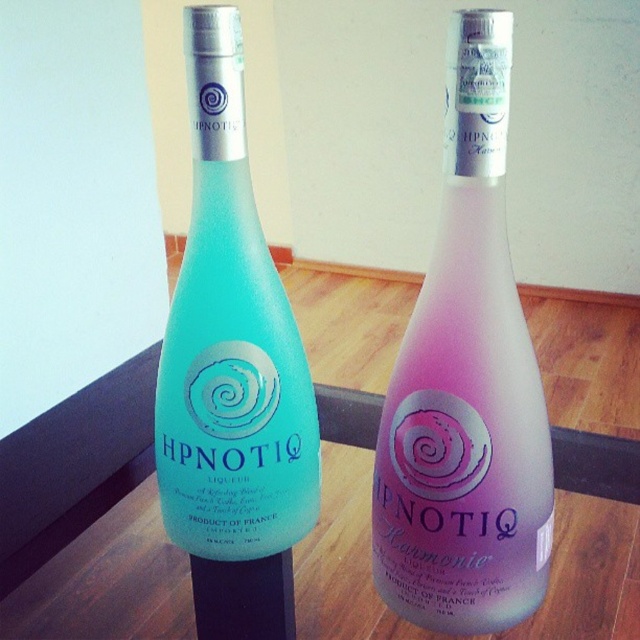
You are at a bar and see two HPNOTIQ liqueur bottles on the counter. The pink glass bottle at center and the matte glass bottle at left. Which one is positioned more to the left?

The matte glass bottle at left is positioned more to the left than the pink glass bottle at center.

You are a bartender preparing a drink and need to know which bottle is shorter. You have two HPNOTIQ liqueur bottles in front of you, a pink glass bottle at center and a matte glass bottle at left. Which one is shorter?

The pink glass bottle at center has a lesser height compared to the matte glass bottle at left, so the pink glass bottle at center is shorter.

You are looking at two points on the HPNOTIQ liqueur bottles. Which point, point (x=515, y=445) or point (x=205, y=358), is closer to you?

Point (x=515, y=445) is closer to the viewer than point (x=205, y=358).